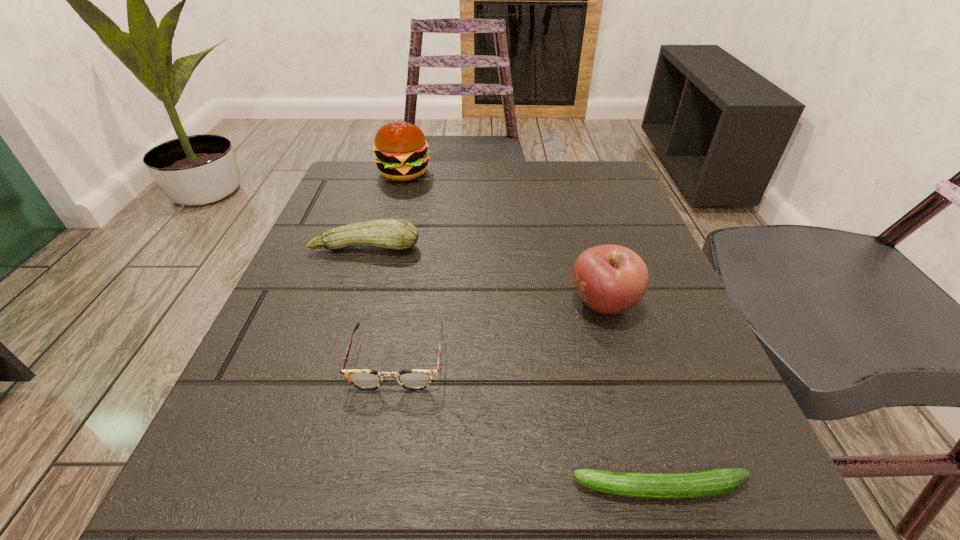
Locate an element on the screen. unoccupied area between the third shortest object and the spectacles is located at coordinates (381, 303).

You are a GUI agent. You are given a task and a screenshot of the screen. Output one action in this format:
    pyautogui.click(x=<x>, y=<y>)
    Task: Click on the unoccupied position between the apple and the shorter zucchini
    Image resolution: width=960 pixels, height=540 pixels.
    Given the screenshot: What is the action you would take?
    pyautogui.click(x=632, y=396)

This screenshot has width=960, height=540. I want to click on free space between the spectacles and the third farthest object, so click(500, 332).

You are a GUI agent. You are given a task and a screenshot of the screen. Output one action in this format:
    pyautogui.click(x=<x>, y=<y>)
    Task: Click on the vacant space that's between the farthest object and the nearer zucchini
    
    Given the screenshot: What is the action you would take?
    pyautogui.click(x=532, y=330)

Identify which object is the fourth closest to the farthest object. Please provide its 2D coordinates. Your answer should be formatted as a tuple, i.e. [(x, y)], where the tuple contains the x and y coordinates of a point satisfying the conditions above.

[(712, 482)]

The height and width of the screenshot is (540, 960). I want to click on object that ranks as the third closest to the shortest object, so (391, 233).